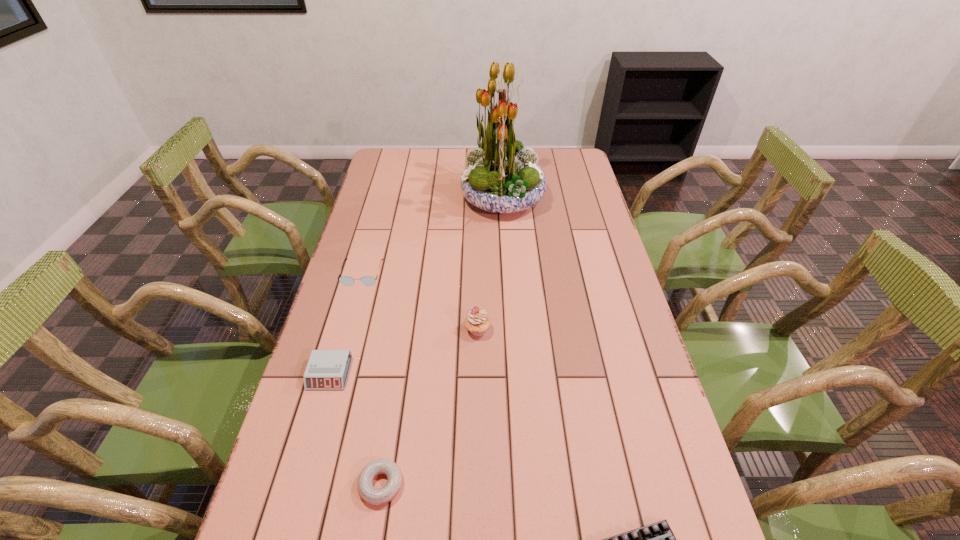
What are the coordinates of `the tallest object` in the screenshot? It's located at (501, 176).

The height and width of the screenshot is (540, 960). What are the coordinates of `flower arrangement` in the screenshot? It's located at (501, 176).

Identify the location of the second tallest object. (477, 322).

The width and height of the screenshot is (960, 540). Find the location of `the third farthest object`. the third farthest object is located at coordinates (477, 322).

This screenshot has width=960, height=540. I want to click on spectacles, so click(347, 281).

Where is `alarm clock`? The width and height of the screenshot is (960, 540). alarm clock is located at coordinates (327, 369).

Locate an element on the screen. the fifth farthest object is located at coordinates (369, 494).

Find the location of `doughnut`. doughnut is located at coordinates (369, 494).

The width and height of the screenshot is (960, 540). Identify the location of free location located on the front-facing side of the tallest object. (389, 199).

You are a GUI agent. You are given a task and a screenshot of the screen. Output one action in this format:
    pyautogui.click(x=<x>, y=<y>)
    Task: Click on the blank space located on the front-facing side of the tallest object
    
    Given the screenshot: What is the action you would take?
    pyautogui.click(x=430, y=199)